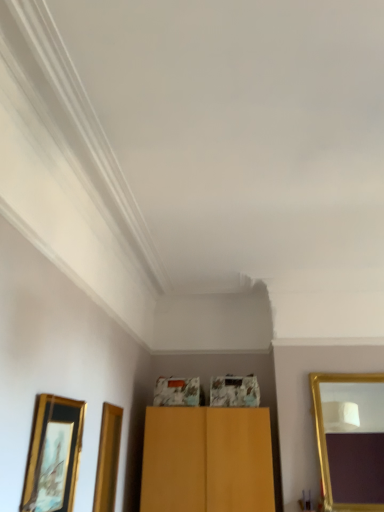
What is the approximate width of gold-framed picture at lower left?

gold-framed picture at lower left is 6.73 centimeters in width.

Where is `gold-framed picture at lower left`? gold-framed picture at lower left is located at coordinates (54, 454).

The image size is (384, 512). Describe the element at coordinates (54, 454) in the screenshot. I see `gold-framed picture at lower left` at that location.

Consider the image. In order to face gold-framed picture at lower left, should I rotate leftwards or rightwards?

To face it directly, rotate left by 17.367 degrees.

Measure the distance between gold-framed mirror at right and camera.

gold-framed mirror at right is 3.28 meters away from camera.

You are a GUI agent. You are given a task and a screenshot of the screen. Output one action in this format:
    pyautogui.click(x=<x>, y=<y>)
    Task: Click on the gold-framed mirror at right
    
    Given the screenshot: What is the action you would take?
    pyautogui.click(x=350, y=439)

The image size is (384, 512). Describe the element at coordinates (350, 439) in the screenshot. I see `gold-framed mirror at right` at that location.

The height and width of the screenshot is (512, 384). Find the location of `gold-framed picture at lower left`. gold-framed picture at lower left is located at coordinates (54, 454).

Can you confirm if gold-framed mirror at right is positioned to the left of gold-framed picture at lower left?

In fact, gold-framed mirror at right is to the right of gold-framed picture at lower left.

Does gold-framed mirror at right come behind gold-framed picture at lower left?

Yes, the depth of gold-framed mirror at right is greater than that of gold-framed picture at lower left.

Does point (341, 510) appear closer or farther from the camera than point (62, 498)?

Clearly, point (341, 510) is more distant from the camera than point (62, 498).

From the image's perspective, which object appears higher, gold-framed mirror at right or gold-framed picture at lower left?

gold-framed picture at lower left.

From a real-world perspective, which is physically above, gold-framed mirror at right or gold-framed picture at lower left?

From a 3D spatial view, gold-framed mirror at right is above.

Does gold-framed mirror at right have a greater width compared to gold-framed picture at lower left?

Correct, the width of gold-framed mirror at right exceeds that of gold-framed picture at lower left.

Is gold-framed mirror at right taller or shorter than gold-framed picture at lower left?

In the image, gold-framed mirror at right appears to be taller than gold-framed picture at lower left.

Considering the sizes of objects gold-framed mirror at right and gold-framed picture at lower left in the image provided, who is bigger, gold-framed mirror at right or gold-framed picture at lower left?

With larger size is gold-framed mirror at right.

Which is correct: gold-framed mirror at right is inside gold-framed picture at lower left, or outside of it?

gold-framed mirror at right lies outside gold-framed picture at lower left.

Is gold-framed mirror at right placed right next to gold-framed picture at lower left?

No, gold-framed mirror at right is not beside gold-framed picture at lower left.

Based on the photo, is gold-framed mirror at right aimed at gold-framed picture at lower left?

No.

In order to click on picture frame directly beneath the gold-framed mirror at right (from a real-world perspective) in this screenshot , I will do `click(54, 454)`.

Which is more to the right, gold-framed picture at lower left or gold-framed mirror at right?

gold-framed mirror at right.

Between gold-framed picture at lower left and gold-framed mirror at right, which one is positioned in front?

gold-framed picture at lower left is more forward.

Between point (60, 436) and point (370, 420), which one is positioned in front?

Positioned in front is point (60, 436).

From the image's perspective, is gold-framed picture at lower left under gold-framed mirror at right?

Actually, gold-framed picture at lower left appears above gold-framed mirror at right in the image.

From a real-world perspective, relative to gold-framed mirror at right, is gold-framed picture at lower left vertically above or below?

Clearly, from a real-world perspective, gold-framed picture at lower left is below gold-framed mirror at right.

Which of these two, gold-framed picture at lower left or gold-framed mirror at right, is wider?

With larger width is gold-framed mirror at right.

Considering the sizes of objects gold-framed picture at lower left and gold-framed mirror at right in the image provided, who is taller, gold-framed picture at lower left or gold-framed mirror at right?

gold-framed mirror at right is taller.

Considering the relative sizes of gold-framed picture at lower left and gold-framed mirror at right in the image provided, is gold-framed picture at lower left smaller than gold-framed mirror at right?

Yes, gold-framed picture at lower left is smaller than gold-framed mirror at right.

From the picture: Would you say gold-framed mirror at right is part of gold-framed picture at lower left's contents?

No, gold-framed mirror at right is not inside gold-framed picture at lower left.

Consider the image. Would you say gold-framed picture at lower left is a long distance from gold-framed mirror at right?

gold-framed picture at lower left is positioned a significant distance from gold-framed mirror at right.

Could you tell me if gold-framed picture at lower left is turned towards gold-framed mirror at right?

No, gold-framed picture at lower left is not aimed at gold-framed mirror at right.

How many degrees apart are the facing directions of gold-framed picture at lower left and gold-framed mirror at right?

87.3 degrees separate the facing orientations of gold-framed picture at lower left and gold-framed mirror at right.

How much distance is there between gold-framed picture at lower left and gold-framed mirror at right?

The distance of gold-framed picture at lower left from gold-framed mirror at right is 7.75 feet.

There is a gold-framed picture at lower left. Identify the location of mirror above it (from a real-world perspective). The width and height of the screenshot is (384, 512). (350, 439).

Find the location of a particular element. The width and height of the screenshot is (384, 512). picture frame on the left of gold-framed mirror at right is located at coordinates (54, 454).

The image size is (384, 512). I want to click on picture frame directly beneath the gold-framed mirror at right (from a real-world perspective), so click(x=54, y=454).